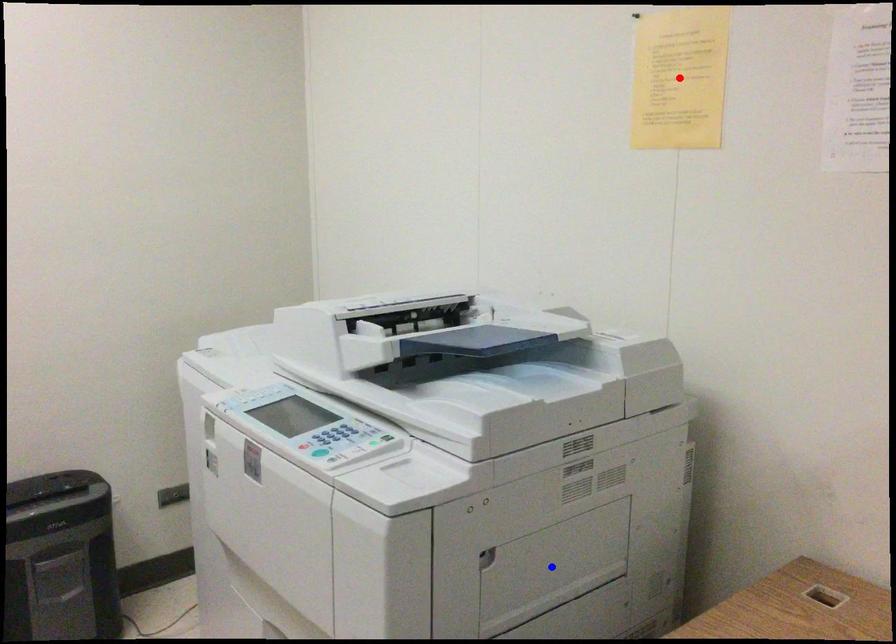
Question: In the image, two points are highlighted. Which point is nearer to the camera? Reply with the corresponding letter.

Choices:
 (A) blue point
 (B) red point

Answer: (A)